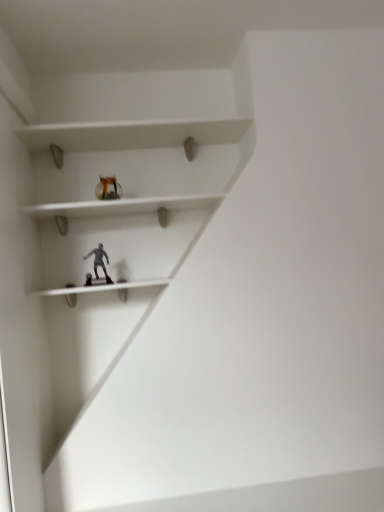
At what (x,y) coordinates should I click in order to perform the action: click on free space behind translucent glass vase at upper center. Please return your answer as a coordinate pair (x, y). The height and width of the screenshot is (512, 384). Looking at the image, I should click on (117, 199).